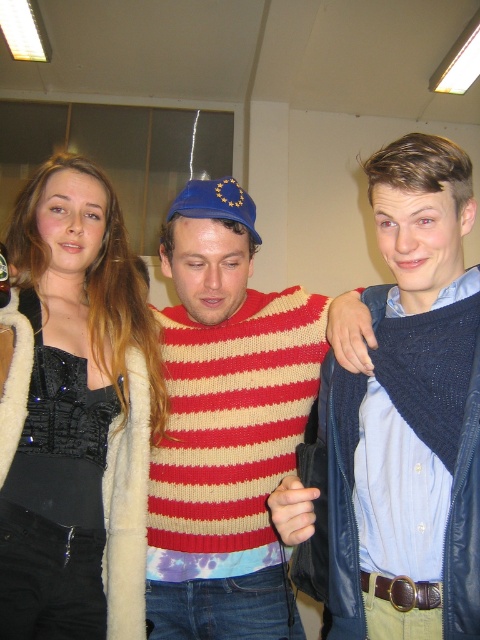
You are standing 1 meter away from the image. Is the point at coordinates point (430, 150) closer to you than the other parts of the image?

The distance of point (430, 150) from viewer is 94.21 centimeters, so since you are standing 1 meter away from the image, the point is closer to you than the other parts of the image.